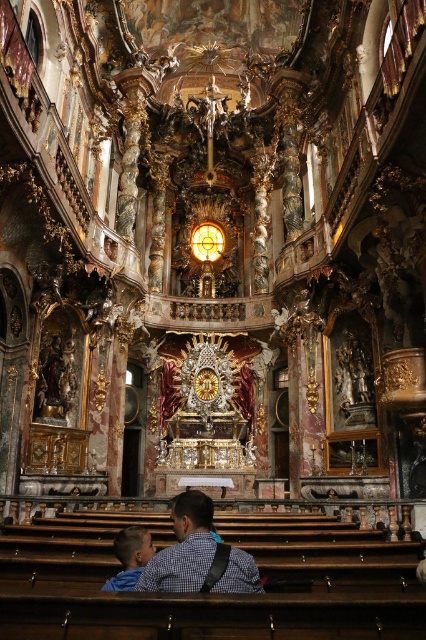
You are standing in the church and need to locate both the checkered shirt at lower center and the blue denim jacket at lower left. Which one is positioned to the right of the other?

The checkered shirt at lower center is to the right of the blue denim jacket at lower left.

You are standing in the grand church and want to take a closer look at the checkered shirt at lower center and the blue denim jacket at lower left. Which one would you need to walk towards first to get closer to both?

You should first walk towards the checkered shirt at lower center because it is closer to you than the blue denim jacket at lower left, so reaching it first would allow you to examine both items efficiently.

You are an interior designer assessing the spatial compatibility of clothing items in the church. Given the checkered shirt at lower center and the blue denim jacket at lower left, which clothing item is wider?

The checkered shirt at lower center is wider than the blue denim jacket at lower left according to the description.